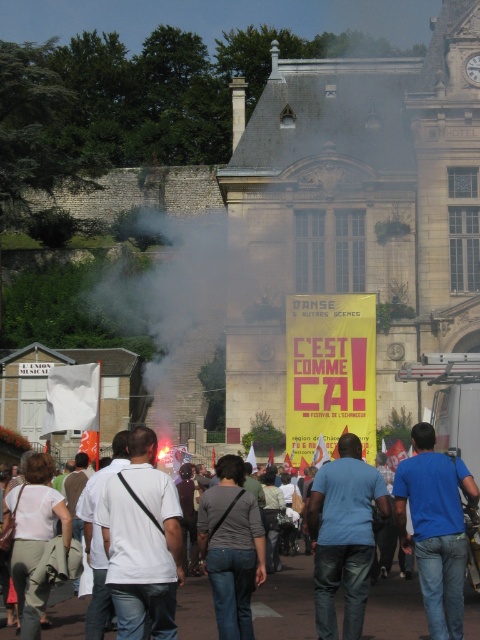
You are observing a group of people participating in a festival. You notice two pairs of jeans in the scene. The first is labeled as blue denim jeans at lower right, and the second is denim jeans at center. From your vantage point, which pair of jeans appears to be positioned higher up?

The blue denim jeans at lower right is above denim jeans at center, so the blue denim jeans at lower right appears higher up.

You are standing at the center of the image and want to find the blue denim jeans at lower right. According to the spatial coordinates provided, in which direction should you look to locate it?

The blue denim jeans at lower right is located at point (435,528), which means you should look to the lower right direction from the center of the image to find it.